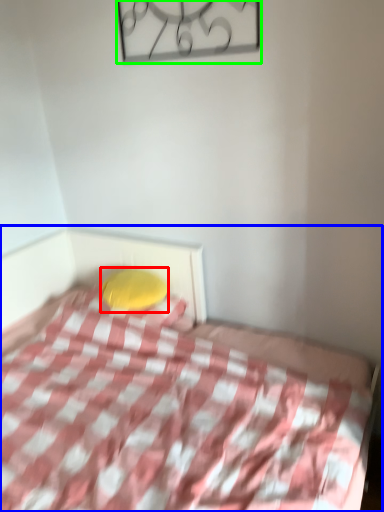
Question: Based on their relative distances, which object is farther from pillow (highlighted by a red box)? Choose from bed (highlighted by a blue box) and design (highlighted by a green box).

Choices:
 (A) bed
 (B) design

Answer: (B)